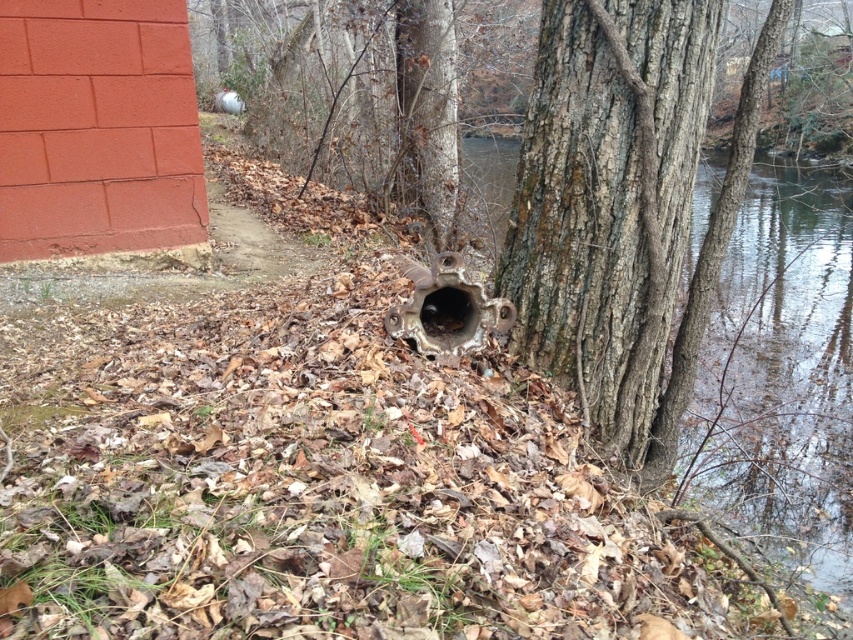
Who is taller, dark brown rough bark at center or transparent water at tree right?

transparent water at tree right is taller.

Can you confirm if dark brown rough bark at center is wider than transparent water at tree right?

In fact, dark brown rough bark at center might be narrower than transparent water at tree right.

Is point (535, 104) positioned before point (734, 408)?

Yes, point (535, 104) is in front of point (734, 408).

Where is `dark brown rough bark at center`? This screenshot has height=640, width=853. dark brown rough bark at center is located at coordinates (608, 202).

Between transparent water at tree right and metallic pipe at center, which one has more height?

Standing taller between the two is transparent water at tree right.

This screenshot has width=853, height=640. In order to click on transparent water at tree right in this screenshot , I will do `click(781, 380)`.

Can you confirm if dark brown rough bark at center is positioned below metallic pipe at center?

Incorrect, dark brown rough bark at center is not positioned below metallic pipe at center.

Is dark brown rough bark at center closer to the viewer compared to metallic pipe at center?

Yes, it is.

Which is behind, point (543, 198) or point (473, 324)?

Positioned behind is point (473, 324).

Identify the location of dark brown rough bark at center. This screenshot has height=640, width=853. [x=608, y=202].